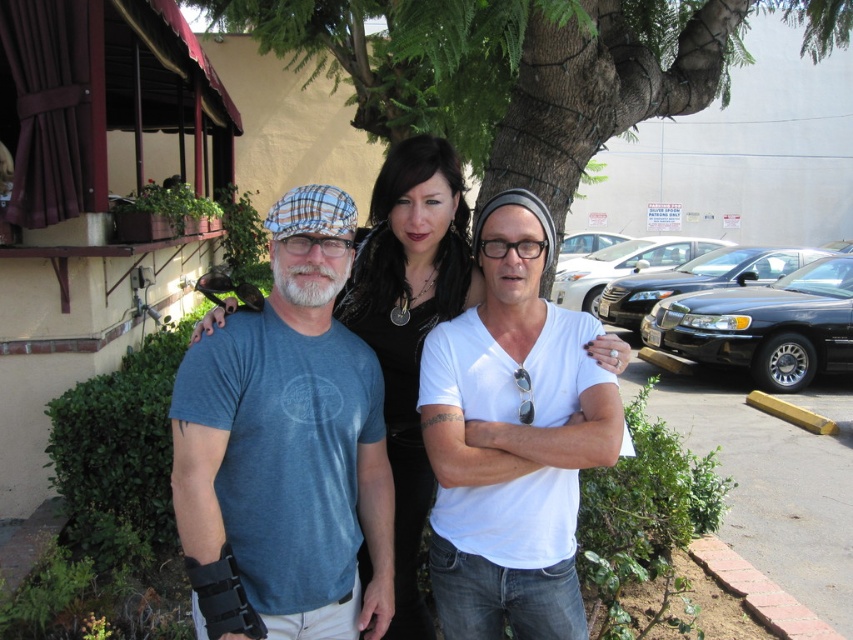
Question: Observing the image, what is the correct spatial positioning of blue cotton t-shirt at center in reference to matte plaid goggles at center?

Choices:
 (A) above
 (B) below

Answer: (B)

Question: Which point is closer to the camera?

Choices:
 (A) matte plaid goggles at center
 (B) green leafy tree at center
 (C) blue cotton t-shirt at center

Answer: (C)

Question: Does blue cotton t-shirt at center appear on the right side of matte blue t-shirt at center?

Choices:
 (A) yes
 (B) no

Answer: (B)

Question: Which of these objects is positioned farthest from the matte blue t-shirt at center?

Choices:
 (A) transparent plastic glasses at center
 (B) blue cotton t-shirt at center

Answer: (A)

Question: Observing the image, what is the correct spatial positioning of white cotton shirt at center in reference to matte blue t-shirt at center?

Choices:
 (A) below
 (B) above

Answer: (A)

Question: Which object is the closest to the matte blue t-shirt at center?

Choices:
 (A) green leafy tree at center
 (B) blue cotton t-shirt at center

Answer: (B)